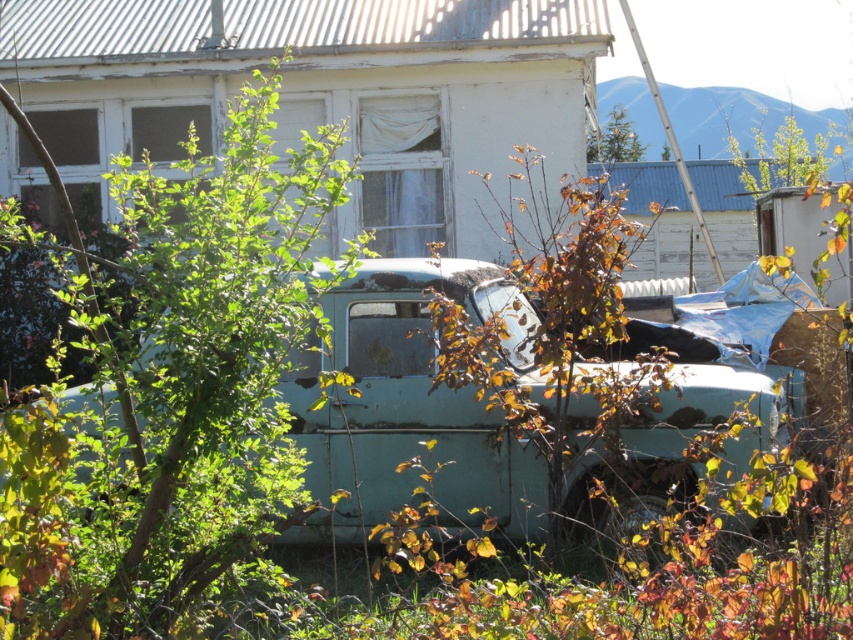
Who is positioned more to the left, light blue matte car at center or green leafy tree at upper center?

From the viewer's perspective, light blue matte car at center appears more on the left side.

Is point (538, 532) positioned behind point (614, 140)?

No, it is not.

The image size is (853, 640). I want to click on light blue matte car at center, so click(412, 404).

Identify the location of light blue matte car at center. (412, 404).

Does green leafy tree at center appear under teal matte pickup truck at center?

No.

What do you see at coordinates (173, 388) in the screenshot? I see `green leafy tree at center` at bounding box center [173, 388].

Between point (50, 547) and point (521, 294), which one is positioned in front?

Positioned in front is point (50, 547).

Image resolution: width=853 pixels, height=640 pixels. I want to click on green leafy tree at center, so click(x=173, y=388).

Between point (22, 588) and point (701, 474), which one is positioned in front?

Point (22, 588) is more forward.

Identify the location of green leafy tree at center. (173, 388).